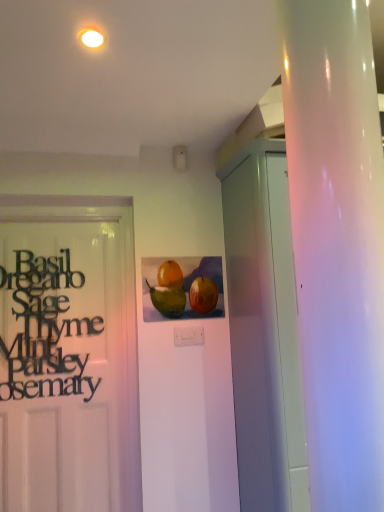
Question: Is white glossy cabinet at right positioned behind watercolor painting of fruits at center?

Choices:
 (A) yes
 (B) no

Answer: (B)

Question: Is white glossy cabinet at right aimed at watercolor painting of fruits at center?

Choices:
 (A) yes
 (B) no

Answer: (B)

Question: From the image's perspective, does white glossy cabinet at right appear higher than watercolor painting of fruits at center?

Choices:
 (A) yes
 (B) no

Answer: (B)

Question: Is white glossy cabinet at right placed right next to watercolor painting of fruits at center?

Choices:
 (A) yes
 (B) no

Answer: (B)

Question: Is white glossy cabinet at right not within watercolor painting of fruits at center?

Choices:
 (A) yes
 (B) no

Answer: (A)

Question: Visually, is black matte sign at left positioned to the left or to the right of white glossy light fixture at upper center?

Choices:
 (A) right
 (B) left

Answer: (B)

Question: In terms of size, does black matte sign at left appear bigger or smaller than white glossy light fixture at upper center?

Choices:
 (A) small
 (B) big

Answer: (B)

Question: Is black matte sign at left wider or thinner than white glossy light fixture at upper center?

Choices:
 (A) wide
 (B) thin

Answer: (B)

Question: From a real-world perspective, is black matte sign at left positioned above or below white glossy light fixture at upper center?

Choices:
 (A) below
 (B) above

Answer: (A)

Question: Based on their sizes in the image, would you say black matte sign at left is bigger or smaller than watercolor painting of fruits at center?

Choices:
 (A) big
 (B) small

Answer: (A)

Question: Looking at their shapes, would you say black matte sign at left is wider or thinner than watercolor painting of fruits at center?

Choices:
 (A) thin
 (B) wide

Answer: (A)

Question: Would you say black matte sign at left is to the left or to the right of watercolor painting of fruits at center in the picture?

Choices:
 (A) left
 (B) right

Answer: (A)

Question: Does point pyautogui.click(x=51, y=283) appear closer or farther from the camera than point pyautogui.click(x=210, y=270)?

Choices:
 (A) farther
 (B) closer

Answer: (B)

Question: Based on their positions, is watercolor painting of fruits at center located to the left or right of white glossy light fixture at upper center?

Choices:
 (A) right
 (B) left

Answer: (A)

Question: In terms of height, does watercolor painting of fruits at center look taller or shorter compared to white glossy light fixture at upper center?

Choices:
 (A) short
 (B) tall

Answer: (B)